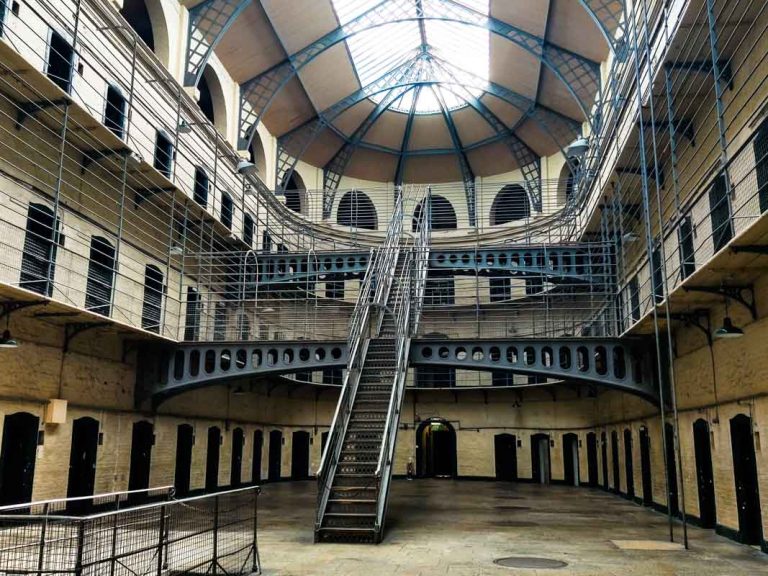
This screenshot has width=768, height=576. Find the location of `linoleum flooring`. linoleum flooring is located at coordinates (445, 557), (567, 529), (429, 501), (290, 507), (280, 554).